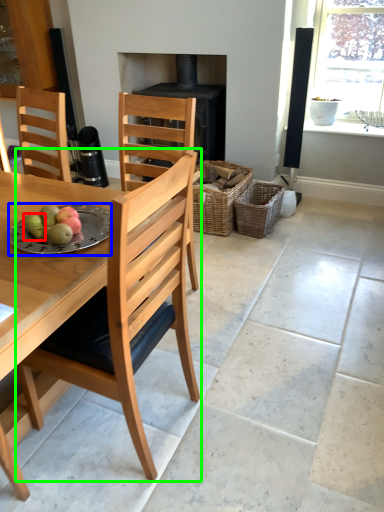
Question: Which object is positioned closest to fruit (highlighted by a red box)? Select from plate (highlighted by a blue box) and chair (highlighted by a green box).

Choices:
 (A) plate
 (B) chair

Answer: (A)